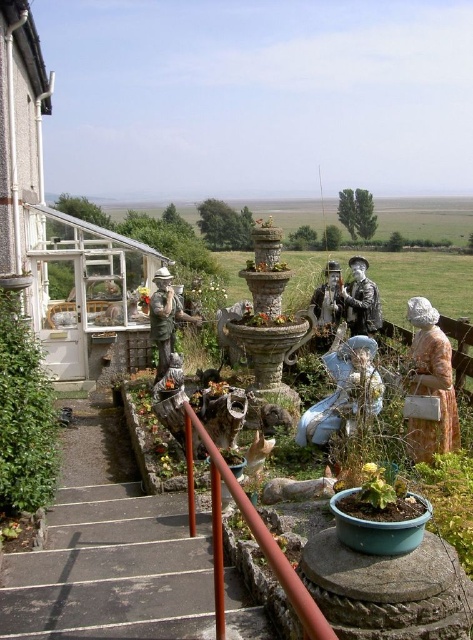
You are designing a pathway in the garden and need to place a new bench. The bench requires a space wider than the widest object between the metallic red handrail at center and the porcelain statue at center. Which object should you avoid placing the bench next to?

The metallic red handrail at center has a lesser width compared to the porcelain statue at center, so you should avoid placing the bench next to the metallic red handrail at center since it is narrower and may not provide enough space for the bench.

You are a gardener carrying a wheelbarrow that is 1.2 meters wide. You want to move from the greenhouse to the garden area. The path between the concrete steps at lower left and the matte bronze statue at center is the only route available. Can your wheelbarrow fit through this path?

The concrete steps at lower left might be wider than matte bronze statue at center, but since the exact width difference isn not specified, it is uncertain if the 1.2 meter wide wheelbarrow can pass through the path. You should measure the space first before attempting to move the wheelbarrow.

You are standing at the bottom of the steps in the garden and want to reach the greenhouse. Which object, the metallic red handrail at center or the porcelain statue at center, is closer to you as you start your journey?

The metallic red handrail at center is closer to the viewer than the porcelain statue at center, so the metallic red handrail at center is closer to you as you start your journey.